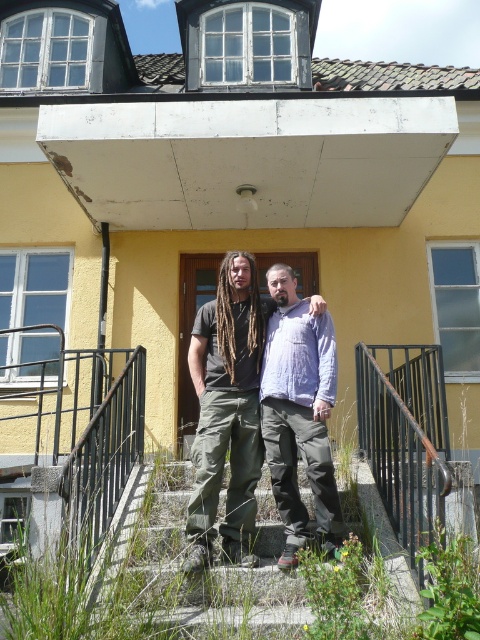
You are a photographer taking a picture of the concrete stairs at center and the matte black shirt at center. Based on their positions, which object is closer to the camera?

The matte black shirt at center is closer to the camera because it is positioned above the concrete stairs at center, which are underneath it.

From the picture: You are a photographer trying to capture a group photo of two people standing on the steps. You notice the light purple cotton shirt at center and the brown dreadlocks at center. Which one is positioned to the right side of the other?

The light purple cotton shirt at center is to the right of brown dreadlocks at center.

You are a photographer taking a portrait of two people standing on steps. You notice the light purple cotton shirt at center and the brown dreadlocks at center. Which of these two is blocking the view of the other?

The light purple cotton shirt at center is blocking the view of the brown dreadlocks at center because it is in front of it.